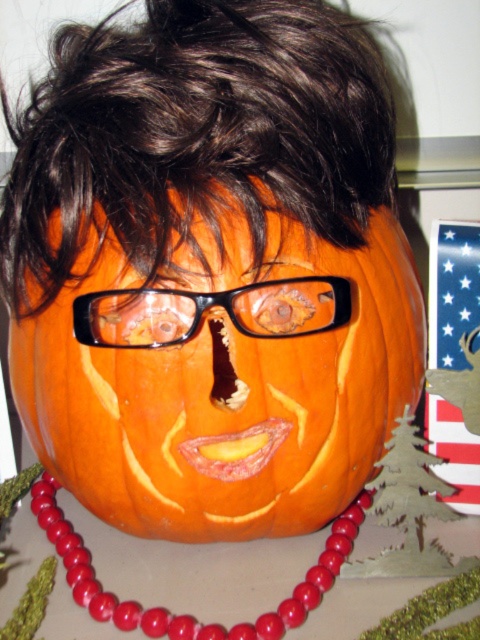
You are planning to place a small decorative hat on the carved pumpkin. The hat is designed to sit on top of the dark brown hair at upper center. Considering the space available, will the hat fit over the red beads at center without touching them?

The dark brown hair at upper center might be wider than red beads at center, so there is a possibility that the hat placed on the dark brown hair at upper center could extend over the red beads at center. To ensure the hat doesn

You are standing in front of the carved pumpkin and want to place a small decoration at the exact center of the pumpkin. Considering the dark brown hair at upper center is located at point 0.208, 0.406, where should you place the decoration relative to this point?

The exact center of the pumpkin would be at the midpoint between the dark brown hair at upper center and the bottom edge of the pumpkin. Since the dark brown hair at upper center is located at point (x=194, y=132), you should move straight down to the center point, which would be halfway between this position and the bottom edge.

You are setting up a Halloween display and need to know if the orange carved pumpkin at center will fit under a shelf that is the same size as the dark brown hair at upper center. Can it fit?

The orange carved pumpkin at center occupies less space than dark brown hair at upper center, so it will fit under the shelf.